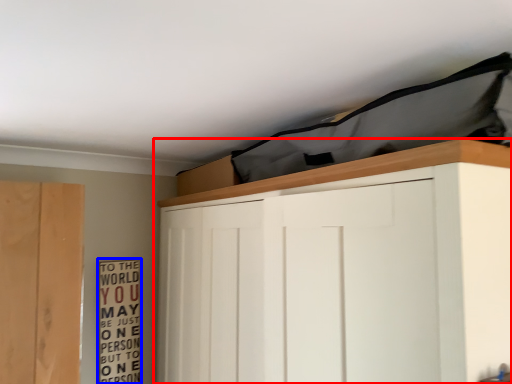
Question: Which object is further to the camera taking this photo, cupboard (highlighted by a red box) or bulletin board (highlighted by a blue box)?

Choices:
 (A) cupboard
 (B) bulletin board

Answer: (B)